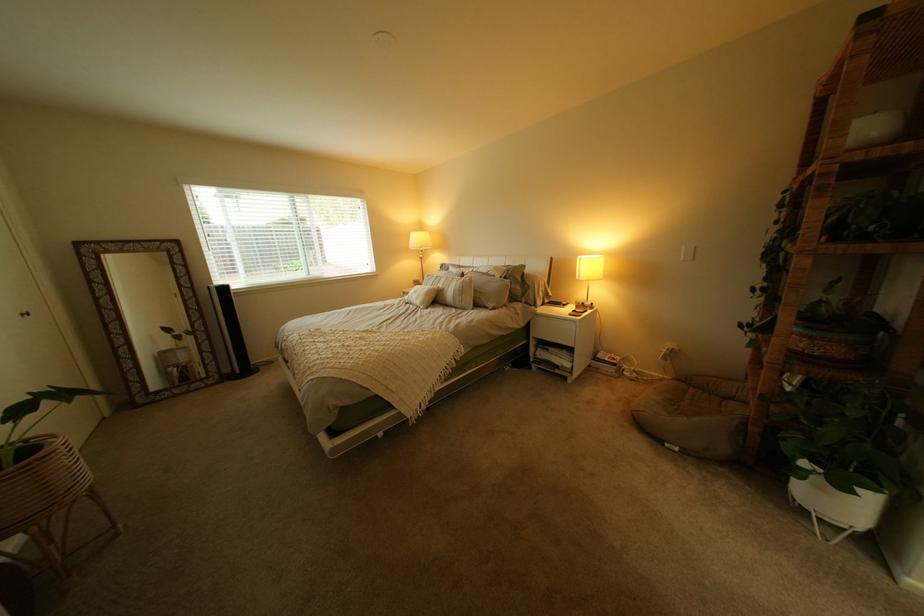
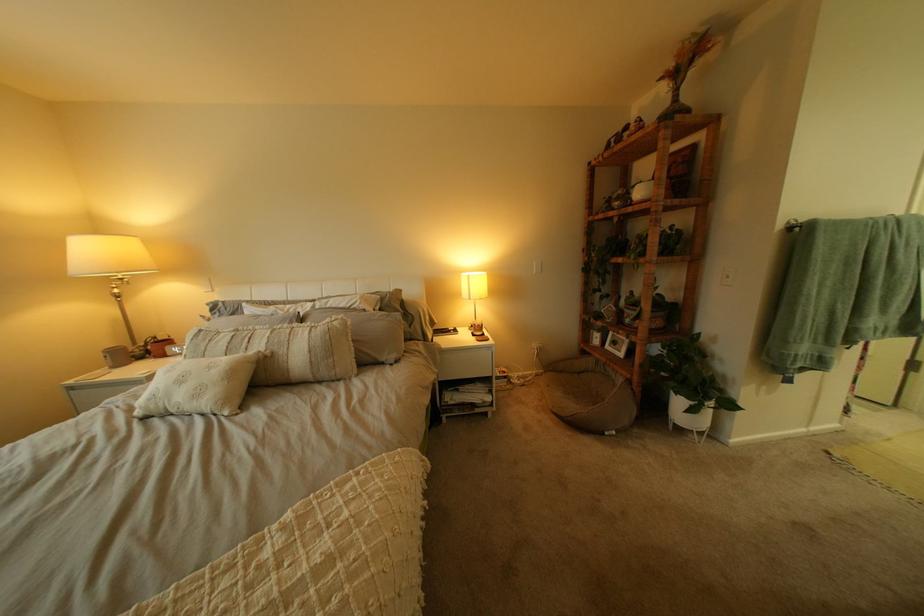
In the second image, find the point that corresponds to pixel 596 259 in the first image.

(483, 277)